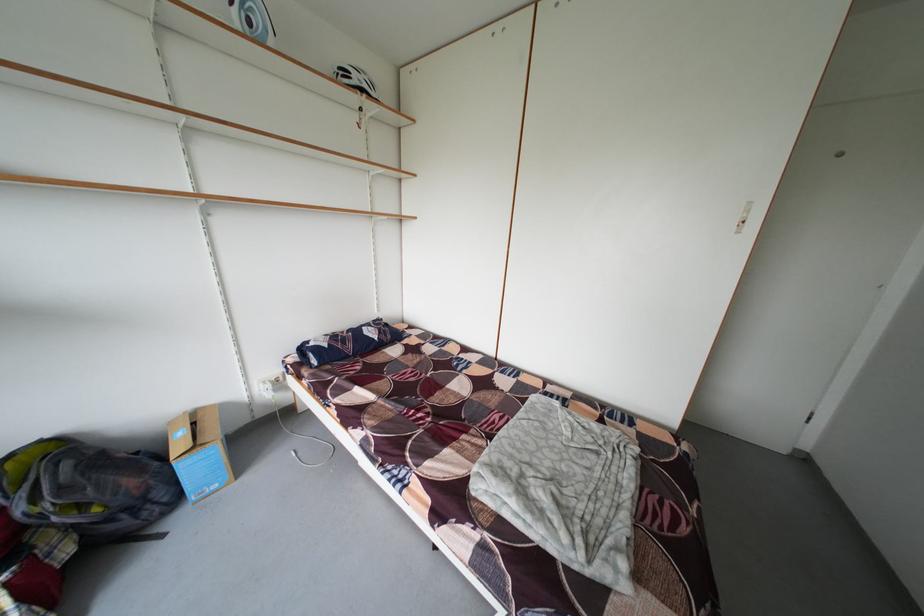
I want to click on white wardrobe handle, so click(744, 217).